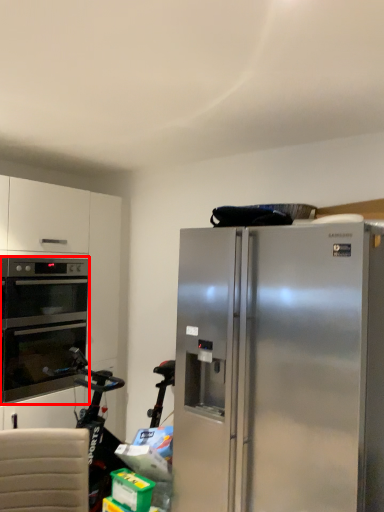
Question: Where is oven (annotated by the red box) located in relation to refrigerator in the image?

Choices:
 (A) right
 (B) left

Answer: (B)